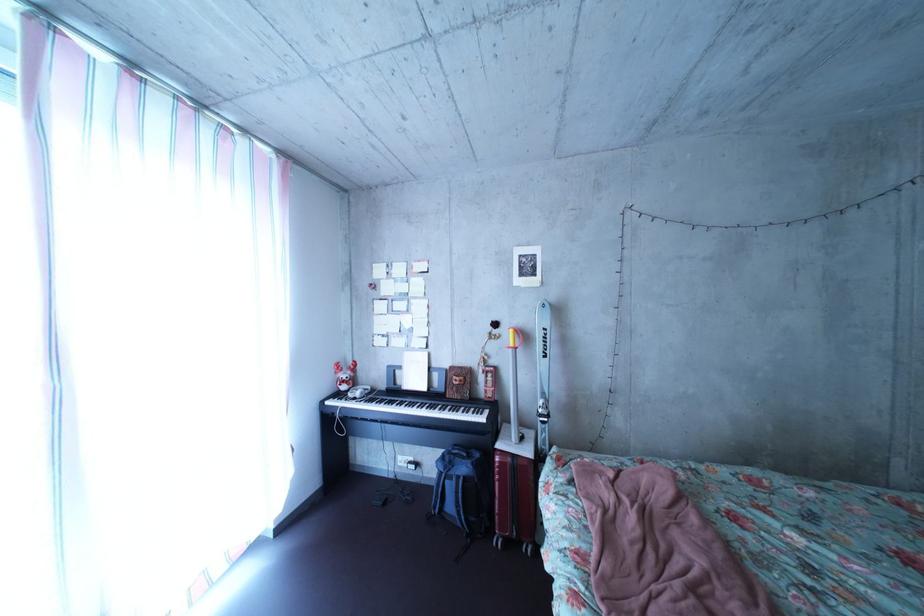
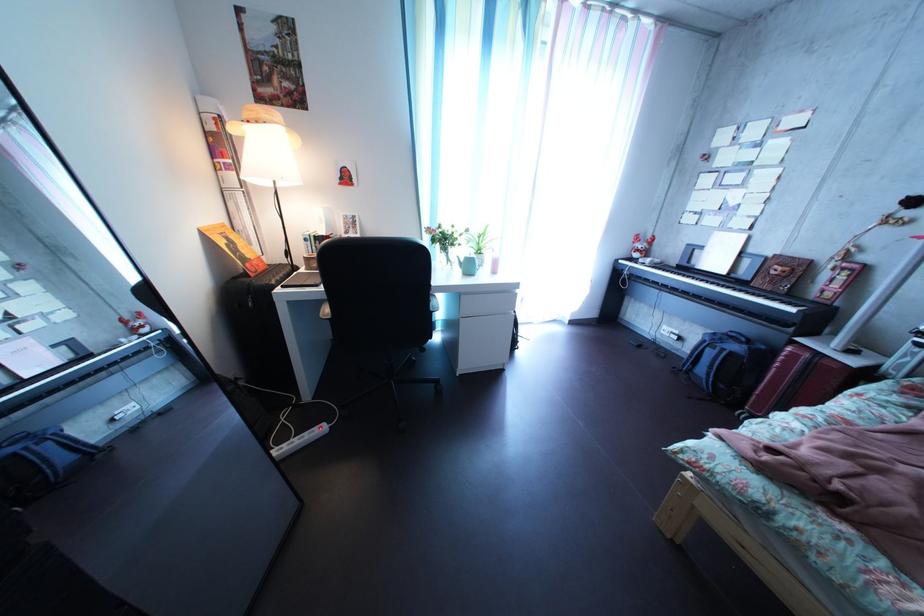
The first image is from the beginning of the video and the second image is from the end. How did the camera likely rotate when shooting the video?

The camera's rotation is toward left-down.